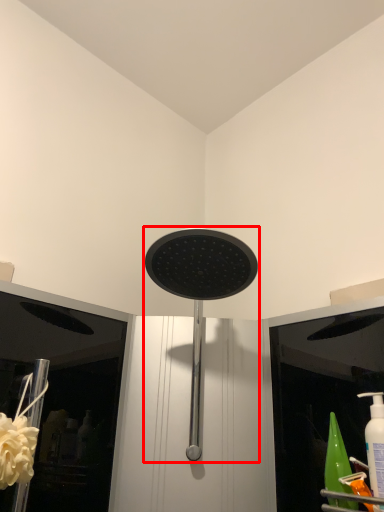
Question: From the image, what is the correct spatial relationship of shower (annotated by the red box) in relation to flower?

Choices:
 (A) right
 (B) left

Answer: (A)